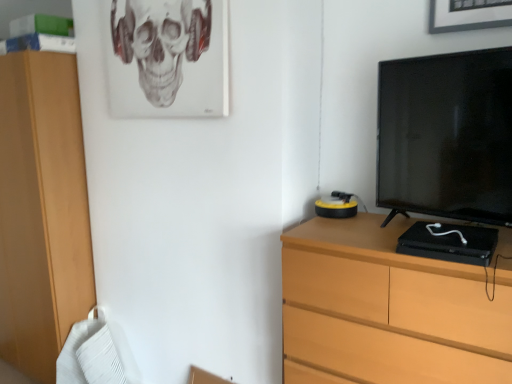
Question: From a real-world perspective, is gray matte skull at upper center physically located above or below black glossy television at right?

Choices:
 (A) below
 (B) above

Answer: (B)

Question: In terms of size, does gray matte skull at upper center appear bigger or smaller than black glossy television at right?

Choices:
 (A) small
 (B) big

Answer: (A)

Question: Based on their relative distances, which object is nearer to the gray matte skull at upper center?

Choices:
 (A) black glossy television at right
 (B) wooden chest of drawers at right

Answer: (A)

Question: Estimate the real-world distances between objects in this image. Which object is closer to the wooden chest of drawers at right?

Choices:
 (A) gray matte skull at upper center
 (B) black glossy television at right

Answer: (B)